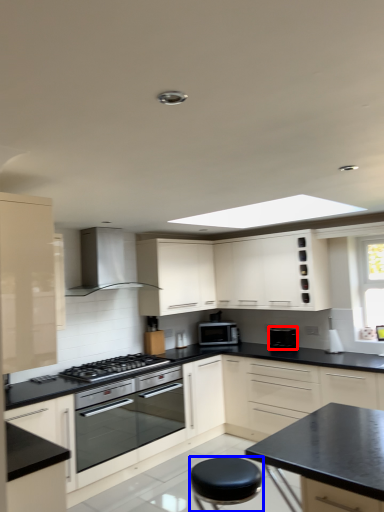
Question: Which point is further to the camera, appliance (highlighted by a red box) or stool (highlighted by a blue box)?

Choices:
 (A) appliance
 (B) stool

Answer: (A)